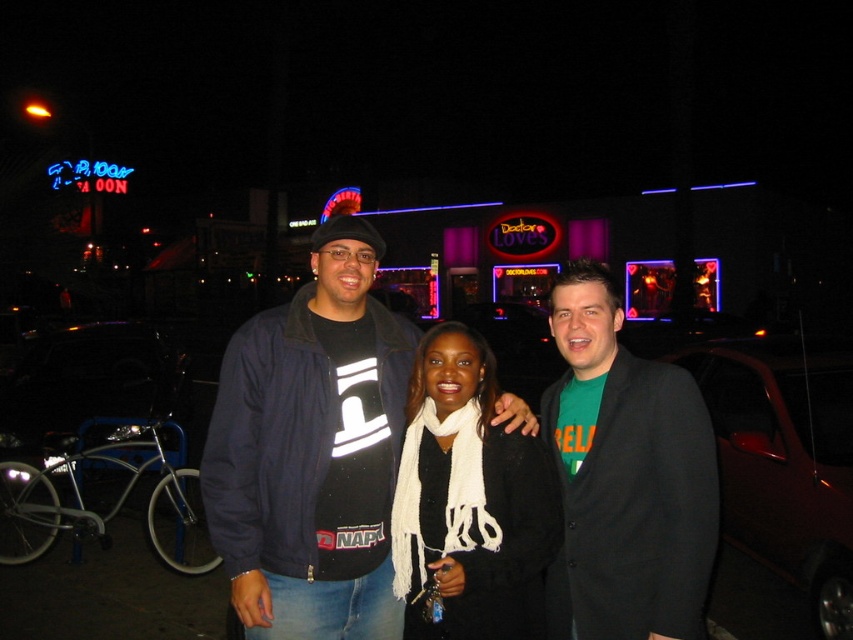
Who is higher up, green fabric shirt at center or dark red metallic car at right?

green fabric shirt at center

Is point (553, 612) farther from viewer compared to point (830, 410)?

That is False.

You are a GUI agent. You are given a task and a screenshot of the screen. Output one action in this format:
    pyautogui.click(x=<x>, y=<y>)
    Task: Click on the green fabric shirt at center
    The width and height of the screenshot is (853, 640).
    Given the screenshot: What is the action you would take?
    pyautogui.click(x=625, y=476)

Does dark blue jacket at center have a greater width compared to white knitted scarf at center?

Yes.

Which of these two, dark blue jacket at center or white knitted scarf at center, stands taller?

dark blue jacket at center

Between point (366, 481) and point (479, 577), which one is positioned behind?

The point (366, 481) is behind.

In order to click on dark blue jacket at center in this screenshot , I will do `click(311, 449)`.

Can you confirm if white knitted scarf at center is thinner than dark red metallic car at right?

Correct, white knitted scarf at center's width is less than dark red metallic car at right's.

Is white knitted scarf at center in front of dark red metallic car at right?

Yes, white knitted scarf at center is in front of dark red metallic car at right.

Is point (556, 508) farther from camera compared to point (790, 564)?

No, it is in front of (790, 564).

You are a GUI agent. You are given a task and a screenshot of the screen. Output one action in this format:
    pyautogui.click(x=<x>, y=<y>)
    Task: Click on the white knitted scarf at center
    Image resolution: width=853 pixels, height=640 pixels.
    Given the screenshot: What is the action you would take?
    pyautogui.click(x=469, y=500)